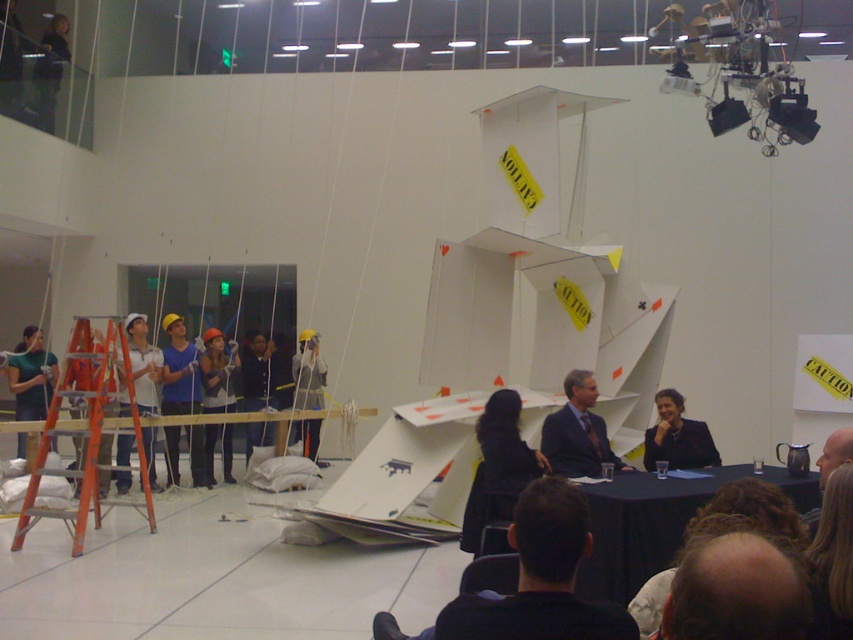
Based on the photo, which of these two, blue fabric at center or matte black jacket at center, stands shorter?

matte black jacket at center

Which is above, blue fabric at center or matte black jacket at center?

matte black jacket at center is above.

You are a GUI agent. You are given a task and a screenshot of the screen. Output one action in this format:
    pyautogui.click(x=<x>, y=<y>)
    Task: Click on the blue fabric at center
    Image resolution: width=853 pixels, height=640 pixels.
    Given the screenshot: What is the action you would take?
    pyautogui.click(x=180, y=371)

Between blonde hair at lower right and blue fabric at center, which one has more height?

With more height is blue fabric at center.

Who is lower down, blonde hair at lower right or blue fabric at center?

Positioned lower is blue fabric at center.

Between point (838, 490) and point (166, 454), which one is positioned behind?

Positioned behind is point (166, 454).

Where is `blonde hair at lower right`? blonde hair at lower right is located at coordinates (833, 560).

Consider the image. Does blonde hair at lower right have a larger size compared to dark blue suit at center?

Indeed, blonde hair at lower right has a larger size compared to dark blue suit at center.

Between point (822, 493) and point (596, 451), which one is positioned behind?

The point (596, 451) is behind.

What are the coordinates of `blonde hair at lower right` in the screenshot? It's located at (833, 560).

You are a GUI agent. You are given a task and a screenshot of the screen. Output one action in this format:
    pyautogui.click(x=<x>, y=<y>)
    Task: Click on the blonde hair at lower right
    
    Given the screenshot: What is the action you would take?
    pyautogui.click(x=833, y=560)